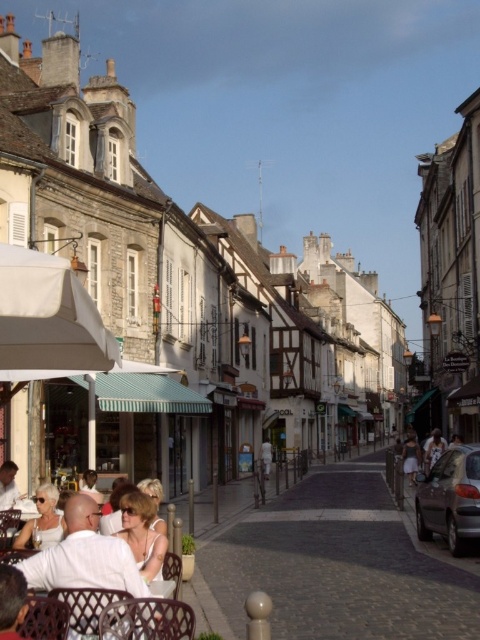
Question: Which of the following is the closest to the observer?

Choices:
 (A) dark gray fabric dress at center
 (B) white fabric umbrella at left

Answer: (B)

Question: Is white fabric sunglasses at center in front of dark gray fabric dress at center?

Choices:
 (A) no
 (B) yes

Answer: (B)

Question: Which object appears closest to the camera in this image?

Choices:
 (A) white tank top at center
 (B) dark gray fabric dress at center
 (C) white fabric umbrella at left

Answer: (A)

Question: Based on their relative distances, which object is farther from the white tank top at center?

Choices:
 (A) white fabric umbrella at lower left
 (B) white fabric dress at lower left

Answer: (A)

Question: Can you confirm if white fabric sunglasses at center is bigger than dark gray fabric dress at center?

Choices:
 (A) yes
 (B) no

Answer: (B)

Question: Is white fabric umbrella at lower left bigger than dark gray fabric dress at center?

Choices:
 (A) yes
 (B) no

Answer: (A)